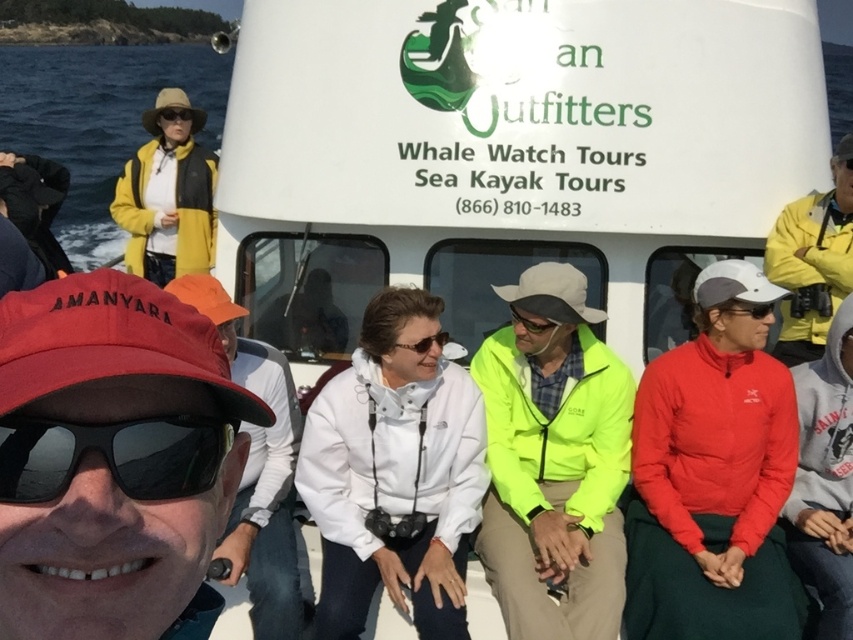
Is neon yellow jacket at center smaller than matte black goggles at center?

No.

Does neon yellow jacket at center appear under matte black goggles at center?

Yes.

Is point (500, 456) closer to viewer compared to point (515, 317)?

Yes, point (500, 456) is in front of point (515, 317).

The height and width of the screenshot is (640, 853). Find the location of `neon yellow jacket at center`. neon yellow jacket at center is located at coordinates (553, 461).

Which is more to the left, white matte jacket at center or matte black goggles at center?

white matte jacket at center is more to the left.

Who is taller, white matte jacket at center or matte black goggles at center?

Standing taller between the two is white matte jacket at center.

The height and width of the screenshot is (640, 853). What are the coordinates of `white matte jacket at center` in the screenshot? It's located at (258, 468).

Between white matte jacket at center and matte black sunglasses at center, which one has less height?

matte black sunglasses at center is shorter.

Measure the distance between white matte jacket at center and camera.

white matte jacket at center and camera are 4.32 meters apart.

Find the location of a particular element. Image resolution: width=853 pixels, height=640 pixels. white matte jacket at center is located at coordinates (258, 468).